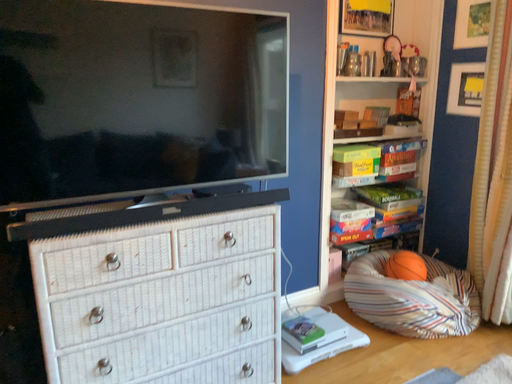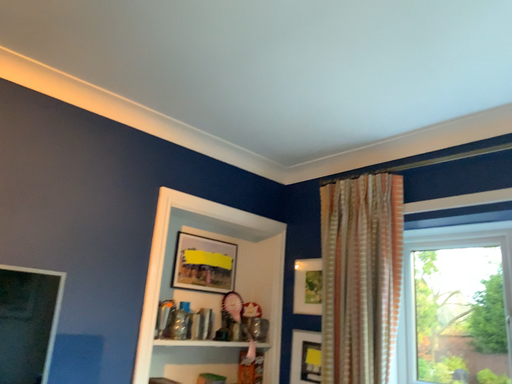
Question: Which way did the camera rotate in the video?

Choices:
 (A) rotated upward
 (B) rotated downward

Answer: (A)